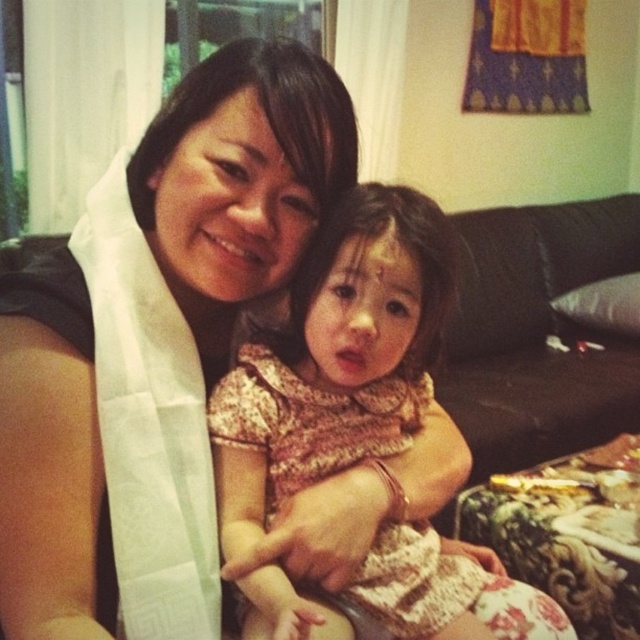
Is floral dress at center positioned before matte white scarf at center?

Yes.

Who is more forward, (316, 476) or (304, 120)?

Point (304, 120) is more forward.

Which is behind, point (280, 428) or point (45, 300)?

The point (280, 428) is more distant.

Find the location of a particular element. The width and height of the screenshot is (640, 640). floral dress at center is located at coordinates (336, 360).

Who is more forward, (515, 248) or (192, 193)?

Point (192, 193)

Is point (536, 448) positioned before point (22, 272)?

No, (536, 448) is further to viewer.

At what (x,y) coordinates should I click in order to perform the action: click on black leather couch at center. Please return your answer as a coordinate pair (x, y). Looking at the image, I should click on (538, 333).

Find the location of a particular element. black leather couch at center is located at coordinates (538, 333).

In the scene shown: Between floral dress at center and black leather couch at center, which one appears on the right side from the viewer's perspective?

Positioned to the right is black leather couch at center.

Can you confirm if floral dress at center is wider than black leather couch at center?

In fact, floral dress at center might be narrower than black leather couch at center.

Is point (300, 472) closer to camera compared to point (541, 400)?

Yes, it is in front of point (541, 400).

Identify the location of floral dress at center. 336,360.